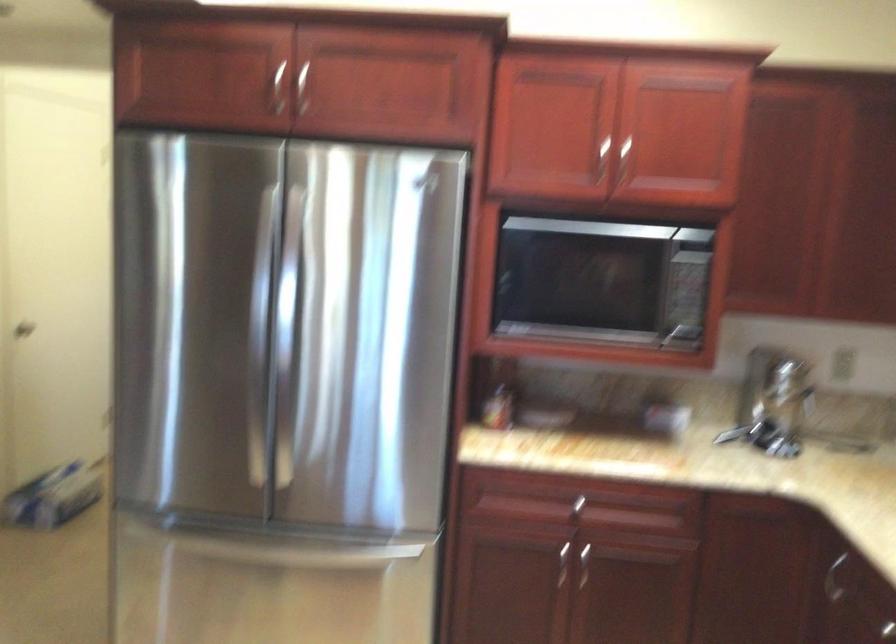
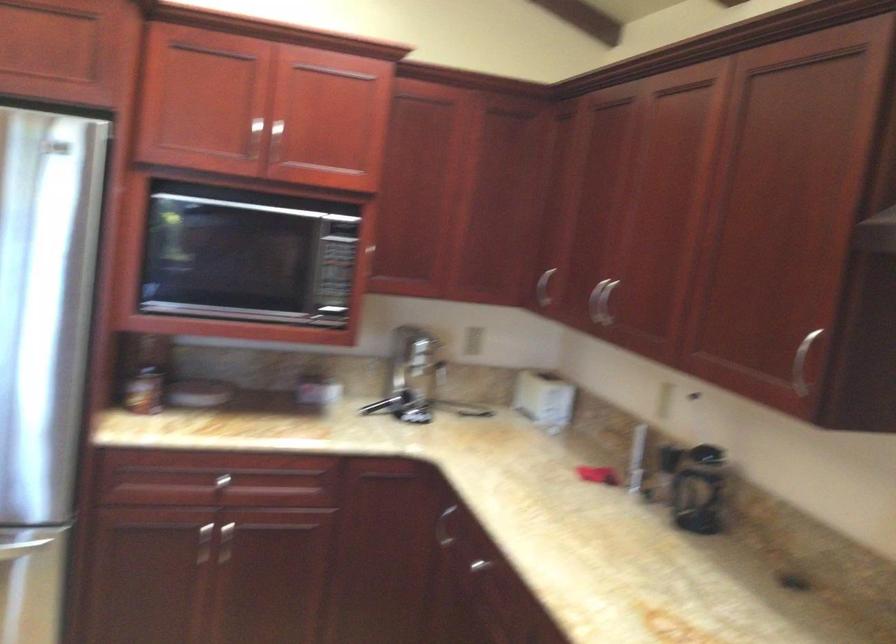
Locate, in the second image, the point that corresponds to (x=622, y=155) in the first image.

(274, 140)